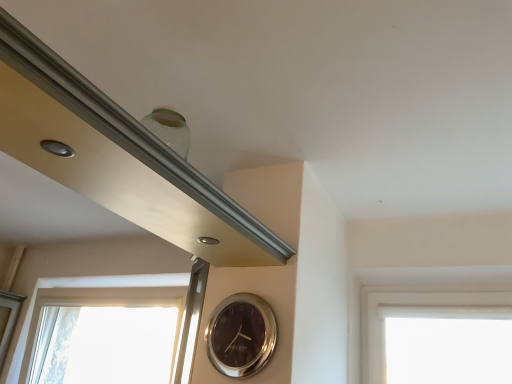
Question: Can shiny silver clock at center be found inside transparent glass window at lower left?

Choices:
 (A) yes
 (B) no

Answer: (B)

Question: Is transparent glass window at lower left with shiny silver clock at center?

Choices:
 (A) yes
 (B) no

Answer: (B)

Question: Could you tell me if transparent glass window at lower left is facing shiny silver clock at center?

Choices:
 (A) no
 (B) yes

Answer: (A)

Question: Can you confirm if transparent glass window at lower left is bigger than shiny silver clock at center?

Choices:
 (A) no
 (B) yes

Answer: (B)

Question: Does transparent glass window at lower left have a greater height compared to shiny silver clock at center?

Choices:
 (A) no
 (B) yes

Answer: (B)

Question: Is transparent glass window at lower left facing away from shiny silver clock at center?

Choices:
 (A) no
 (B) yes

Answer: (A)

Question: Would you say shiny silver clock at center is a long distance from transparent glass window at lower left?

Choices:
 (A) no
 (B) yes

Answer: (B)

Question: Is transparent glass window at lower left a part of shiny silver clock at center?

Choices:
 (A) yes
 (B) no

Answer: (B)

Question: Are shiny silver clock at center and transparent glass window at lower left making contact?

Choices:
 (A) yes
 (B) no

Answer: (B)

Question: Is the depth of shiny silver clock at center greater than that of transparent glass window at lower left?

Choices:
 (A) yes
 (B) no

Answer: (B)

Question: Does shiny silver clock at center have a greater height compared to transparent glass window at lower left?

Choices:
 (A) no
 (B) yes

Answer: (A)

Question: Is shiny silver clock at center oriented towards transparent glass window at lower left?

Choices:
 (A) no
 (B) yes

Answer: (A)

Question: Is transparent glass window at lower left in front of or behind shiny silver clock at center in the image?

Choices:
 (A) front
 (B) behind

Answer: (B)